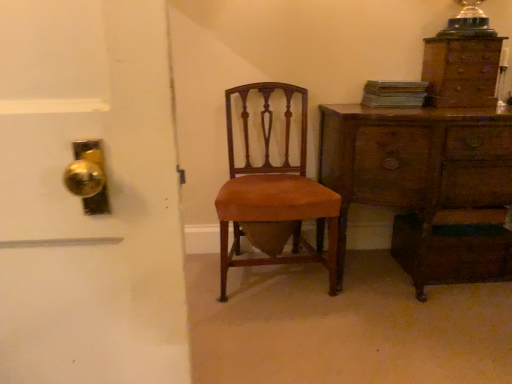
In order to click on free space below brown wood chair at center (from a real-world perspective) in this screenshot , I will do `click(277, 284)`.